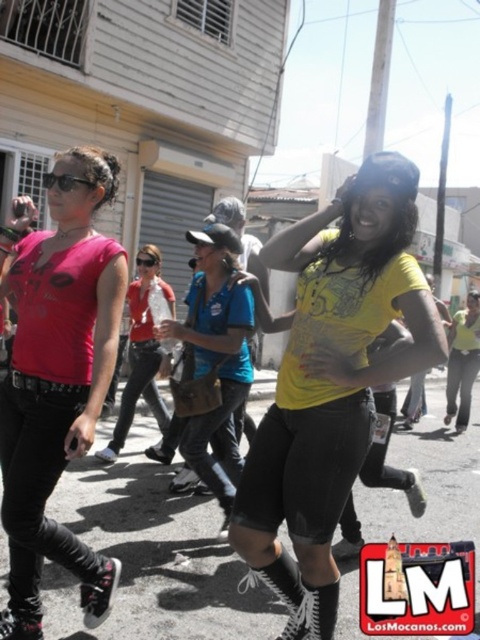
Question: Is yellow matte shirt at center smaller than blue denim shirt at center?

Choices:
 (A) yes
 (B) no

Answer: (B)

Question: Which object is the farthest from the yellow matte shirt at center?

Choices:
 (A) blue denim shirt at center
 (B) matte black shirt at center

Answer: (B)

Question: Which object appears closest to the camera in this image?

Choices:
 (A) yellow matte shirt at center
 (B) matte black shirt at center

Answer: (A)

Question: Does yellow matte shirt at center appear over matte black shirt at center?

Choices:
 (A) yes
 (B) no

Answer: (B)

Question: Does matte pink t-shirt at left come behind blue denim shirt at center?

Choices:
 (A) yes
 (B) no

Answer: (B)

Question: Which is farther from the matte pink t-shirt at left?

Choices:
 (A) yellow matte shirt at center
 (B) matte black shirt at center
 (C) blue denim shirt at center

Answer: (B)